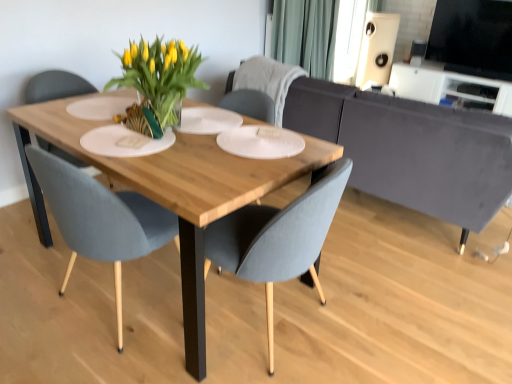
Question: Are gray fabric chair at center, marked as the first chair in a back-to-front arrangement, and white matte window screen at upper center, acting as the 1th window screen starting from the left, far apart?

Choices:
 (A) yes
 (B) no

Answer: (A)

Question: Is gray fabric chair at center, marked as the first chair in a back-to-front arrangement, facing towards white matte window screen at upper center, acting as the 1th window screen starting from the back?

Choices:
 (A) no
 (B) yes

Answer: (B)

Question: Considering the relative sizes of gray fabric chair at center, marked as the first chair in a back-to-front arrangement, and white matte window screen at upper center, the second window screen viewed from the front, in the image provided, is gray fabric chair at center, marked as the first chair in a back-to-front arrangement, thinner than white matte window screen at upper center, the second window screen viewed from the front,?

Choices:
 (A) no
 (B) yes

Answer: (A)

Question: Is gray fabric chair at center, the 3th chair in the front-to-back sequence, not within white matte window screen at upper center, acting as the 1th window screen starting from the back?

Choices:
 (A) no
 (B) yes

Answer: (B)

Question: Is gray fabric chair at center, marked as the first chair in a back-to-front arrangement, to the left of white matte window screen at upper center, the second window screen viewed from the front, from the viewer's perspective?

Choices:
 (A) no
 (B) yes

Answer: (B)

Question: Is white plastic entertainment center at upper right spatially inside white matte window screen at upper center, which is counted as the second window screen, starting from the right, or outside of it?

Choices:
 (A) inside
 (B) outside

Answer: (B)

Question: From their relative heights in the image, would you say white plastic entertainment center at upper right is taller or shorter than white matte window screen at upper center, acting as the 1th window screen starting from the left?

Choices:
 (A) short
 (B) tall

Answer: (A)

Question: Considering the positions of point (397, 74) and point (357, 29), is point (397, 74) closer or farther from the camera than point (357, 29)?

Choices:
 (A) closer
 (B) farther

Answer: (B)

Question: Considering the relative positions of white plastic entertainment center at upper right and white matte window screen at upper center, which is counted as the second window screen, starting from the right, in the image provided, is white plastic entertainment center at upper right to the left or to the right of white matte window screen at upper center, which is counted as the second window screen, starting from the right,?

Choices:
 (A) left
 (B) right

Answer: (B)

Question: From the image's perspective, is green fabric curtain at upper center above or below matte gray chair at center, the 3th chair when ordered from back to front?

Choices:
 (A) above
 (B) below

Answer: (A)

Question: In terms of width, does green fabric curtain at upper center look wider or thinner when compared to matte gray chair at center, which is the 1th chair from front to back?

Choices:
 (A) thin
 (B) wide

Answer: (A)

Question: Is green fabric curtain at upper center taller or shorter than matte gray chair at center, which is the 1th chair from front to back?

Choices:
 (A) short
 (B) tall

Answer: (B)

Question: Based on their sizes in the image, would you say green fabric curtain at upper center is bigger or smaller than matte gray chair at center, the 3th chair when ordered from back to front?

Choices:
 (A) big
 (B) small

Answer: (A)

Question: Is green fabric curtain at upper center inside or outside of gray fabric chair at center, the 3th chair in the front-to-back sequence?

Choices:
 (A) inside
 (B) outside

Answer: (B)

Question: From a real-world perspective, is green fabric curtain at upper center positioned above or below gray fabric chair at center, marked as the first chair in a back-to-front arrangement?

Choices:
 (A) below
 (B) above

Answer: (B)